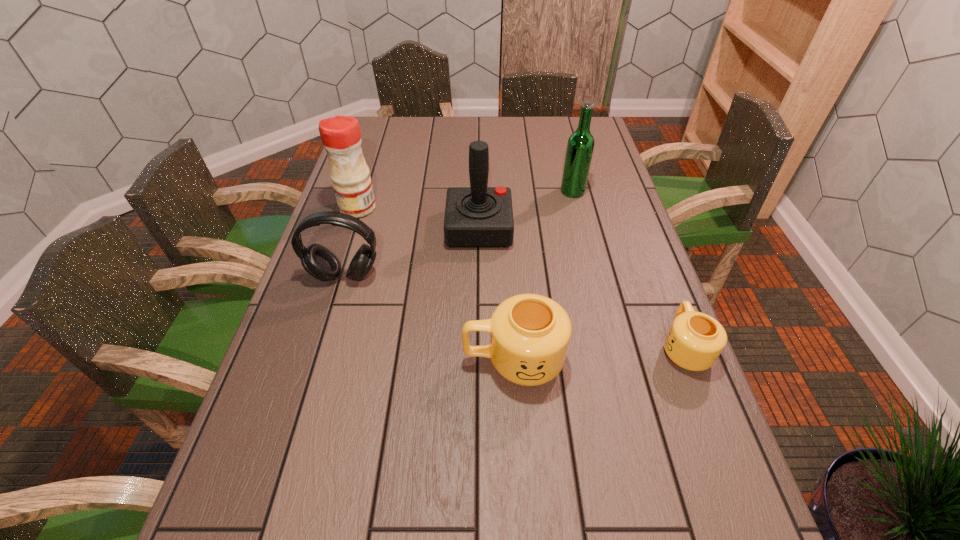
Given the evenly spaced mugs in the image, where should an extra mug be added on the left to preserve the spacing? Please point to a vacant space. Please provide its 2D coordinates. Your answer should be formatted as a tuple, i.e. [(x, y)], where the tuple contains the x and y coordinates of a point satisfying the conditions above.

[(334, 373)]